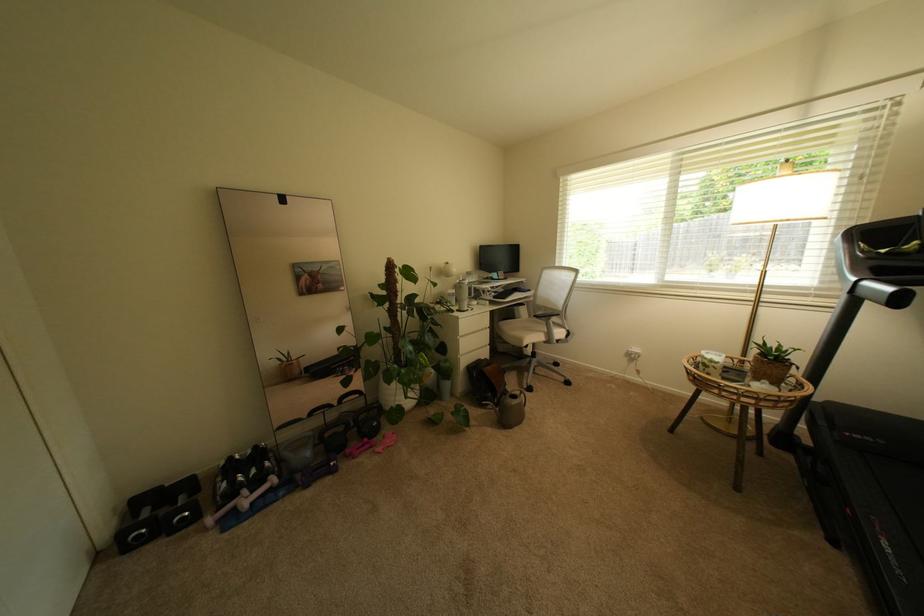
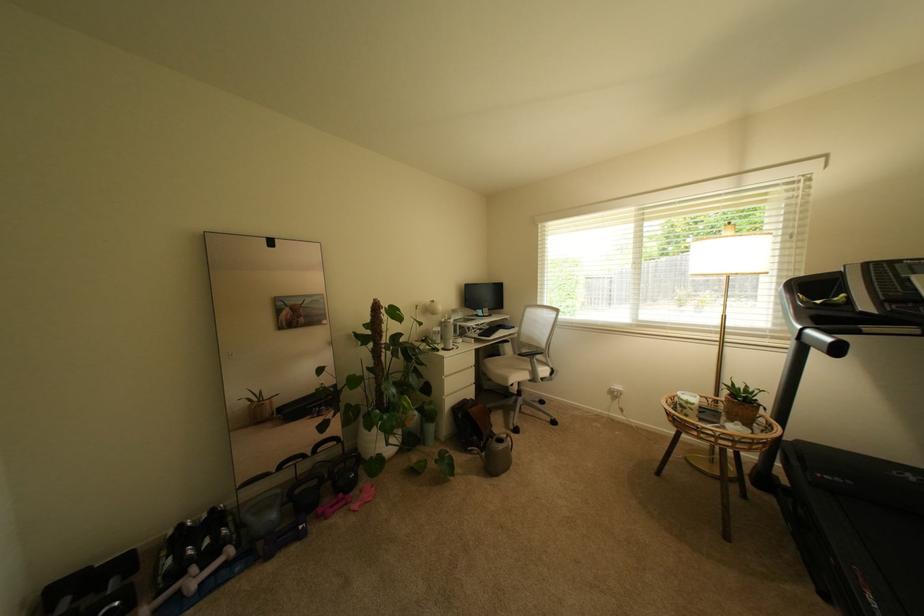
Find the pixel in the second image that matches point (892, 252) in the first image.

(827, 302)